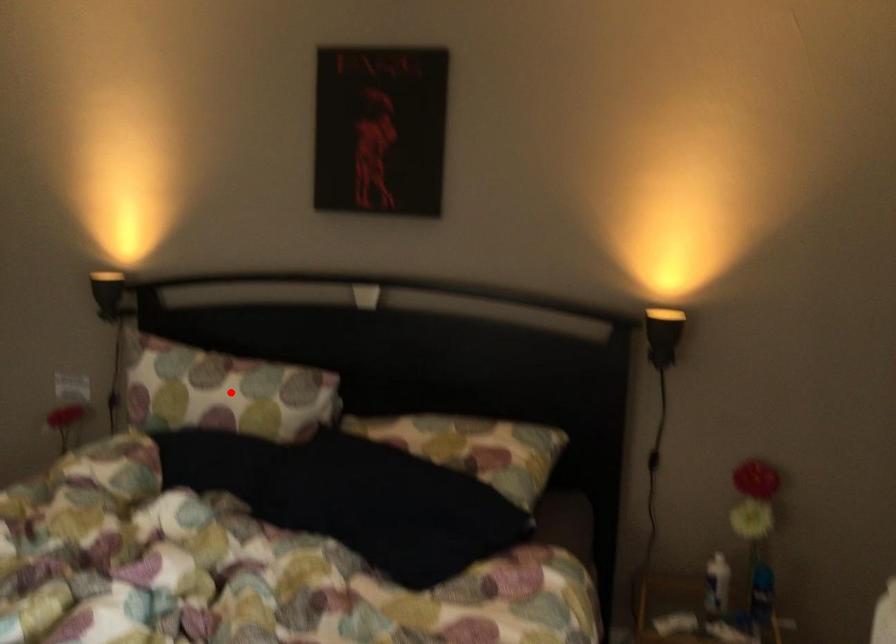
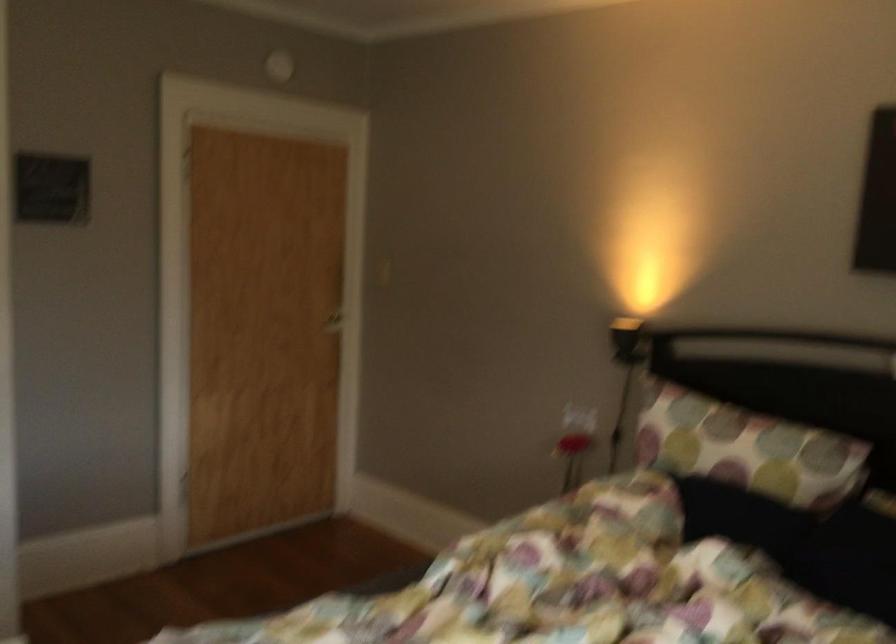
In the second image, find the point that corresponds to the highlighted location in the first image.

(746, 449)